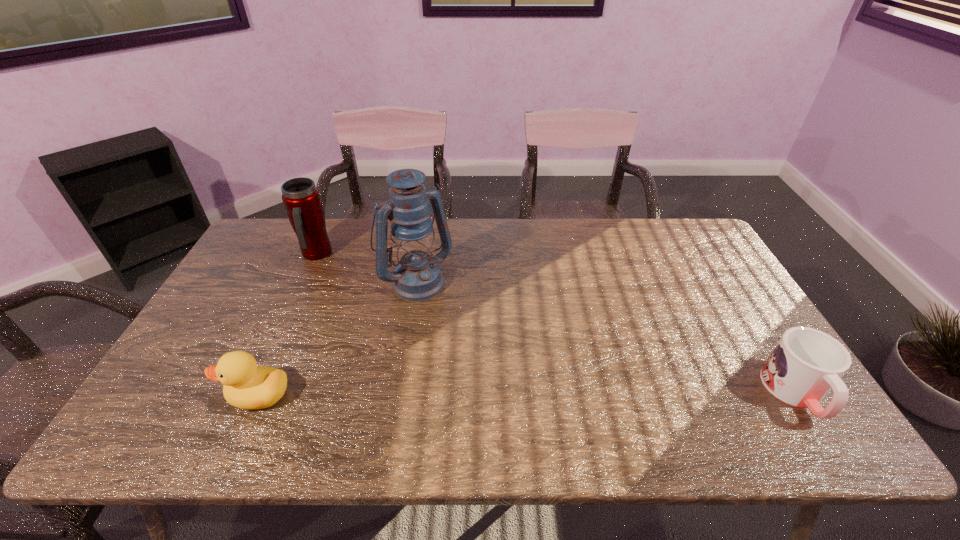
At what (x,y) coordinates should I click in order to perform the action: click on vacant area that lies between the thermos bottle and the duck. Please return your answer as a coordinate pair (x, y). This screenshot has height=540, width=960. Looking at the image, I should click on (287, 325).

Locate an element on the screen. vacant region between the rightmost object and the second object from right to left is located at coordinates (606, 336).

You are a GUI agent. You are given a task and a screenshot of the screen. Output one action in this format:
    pyautogui.click(x=<x>, y=<y>)
    Task: Click on the blank region between the rightmost object and the thermos bottle
    
    Given the screenshot: What is the action you would take?
    pyautogui.click(x=556, y=324)

You are a GUI agent. You are given a task and a screenshot of the screen. Output one action in this format:
    pyautogui.click(x=<x>, y=<y>)
    Task: Click on the empty space that is in between the duck and the second object from right to left
    
    Given the screenshot: What is the action you would take?
    pyautogui.click(x=337, y=338)

Select which object is the third closest to the mug. Please provide its 2D coordinates. Your answer should be formatted as a tuple, i.e. [(x, y)], where the tuple contains the x and y coordinates of a point satisfying the conditions above.

[(301, 198)]

Locate which object is the third closest to the duck. Please provide its 2D coordinates. Your answer should be formatted as a tuple, i.e. [(x, y)], where the tuple contains the x and y coordinates of a point satisfying the conditions above.

[(806, 364)]

Locate an element on the screen. vacant point that satisfies the following two spatial constraints: 1. on the front side of the lantern; 2. on the right side of the second tallest object is located at coordinates (304, 279).

Image resolution: width=960 pixels, height=540 pixels. I want to click on vacant space that satisfies the following two spatial constraints: 1. on the front side of the thermos bottle; 2. at the beak of the duck, so click(x=252, y=395).

At what (x,y) coordinates should I click in order to perform the action: click on blank space that satisfies the following two spatial constraints: 1. on the front side of the third shortest object; 2. at the beak of the duck. Please return your answer as a coordinate pair (x, y). The image size is (960, 540). Looking at the image, I should click on (252, 395).